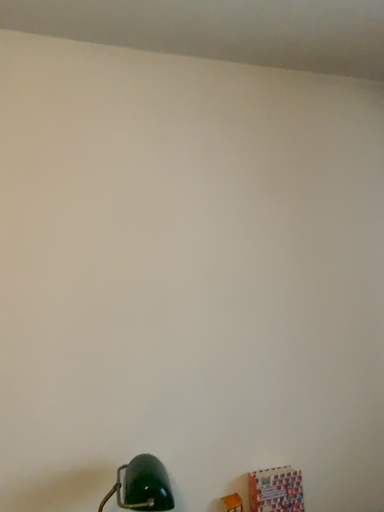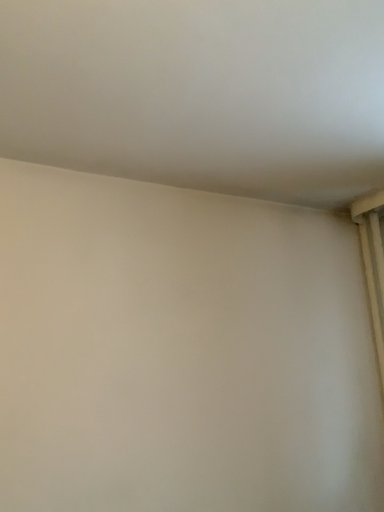
Question: How did the camera likely rotate when shooting the video?

Choices:
 (A) rotated right
 (B) rotated left

Answer: (A)